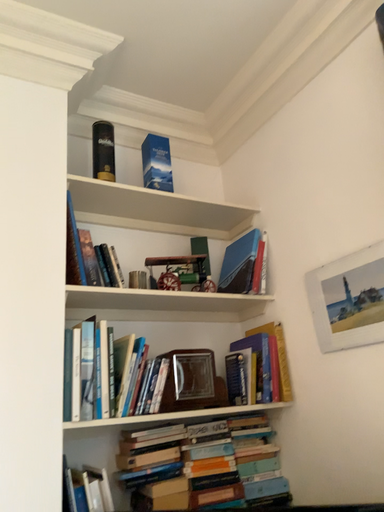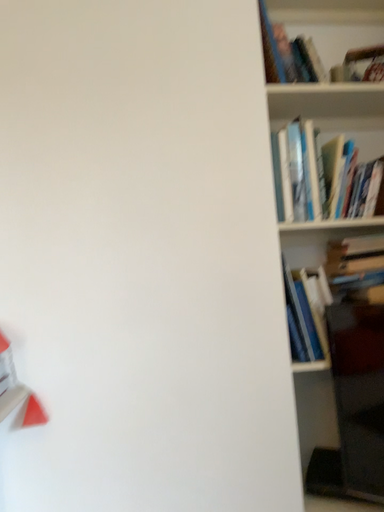
Question: Which way did the camera rotate in the video?

Choices:
 (A) rotated right
 (B) rotated left

Answer: (B)